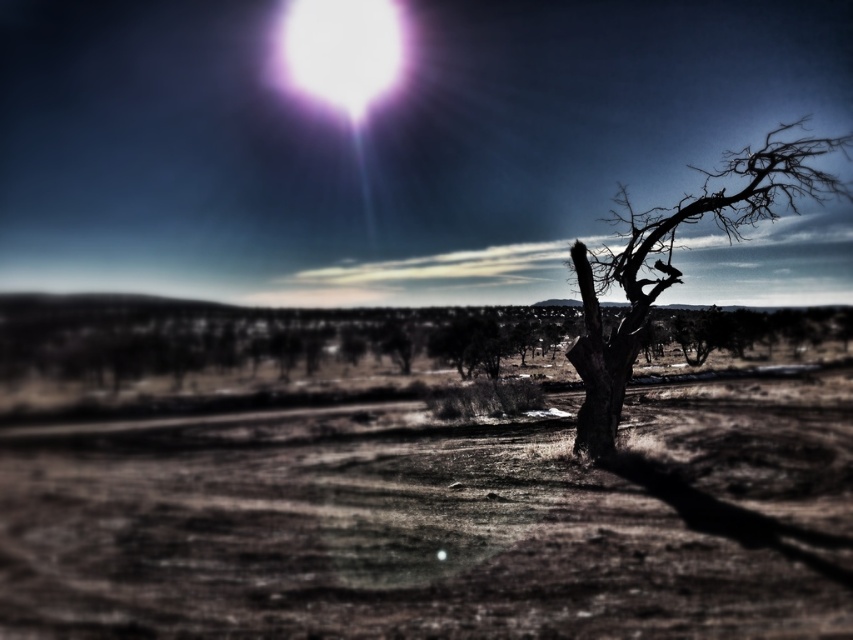
You are an astronomer observing the night sky and notice the dark brown bark tree at right and the bright white orb at upper center. Which object is positioned higher in the sky?

The bright white orb at upper center is positioned higher in the sky than the dark brown bark tree at right.

You are an astronomer observing the night sky and notice the dark brown bark tree at right and the bright white orb at upper center. Which object appears taller in the scene?

The dark brown bark tree at right is taller than the bright white orb at upper center.

You are standing in the desert landscape and see two points marked in the image. One is at coordinates point (364, 524) and the other is at point (387, 28). Which point is nearer to you?

Point (364, 524) is closer to the viewer than point (387, 28).